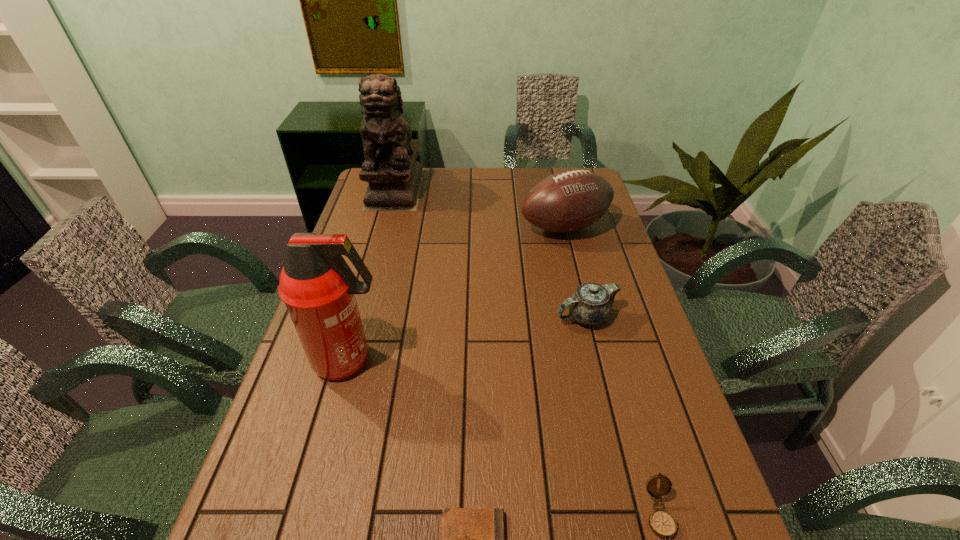
Where is `free region at the far right corner`? free region at the far right corner is located at coordinates (568, 167).

Where is `vacant area that lies between the third nearest object and the fourth shortest object`? The image size is (960, 540). vacant area that lies between the third nearest object and the fourth shortest object is located at coordinates (457, 294).

Where is `unoccupied area between the fire extinguisher and the sculpture`? The width and height of the screenshot is (960, 540). unoccupied area between the fire extinguisher and the sculpture is located at coordinates (372, 274).

This screenshot has width=960, height=540. What are the coordinates of `free space between the fire extinguisher and the fourth shortest object` in the screenshot? It's located at (457, 294).

The height and width of the screenshot is (540, 960). In order to click on vacant space that's between the third nearest object and the sculpture in this screenshot , I will do `click(372, 274)`.

In order to click on vacant space that is in between the fire extinguisher and the chinaware in this screenshot , I will do `click(468, 339)`.

Where is `free space between the football (American) and the fire extinguisher`? The image size is (960, 540). free space between the football (American) and the fire extinguisher is located at coordinates (457, 294).

I want to click on vacant space that is in between the third nearest object and the chinaware, so click(468, 339).

Select which object appears as the fifth closest to the third object from left to right. Please provide its 2D coordinates. Your answer should be formatted as a tuple, i.e. [(x, y)], where the tuple contains the x and y coordinates of a point satisfying the conditions above.

[(394, 176)]

Locate which object is the fifth closest to the shortest object. Please provide its 2D coordinates. Your answer should be formatted as a tuple, i.e. [(x, y)], where the tuple contains the x and y coordinates of a point satisfying the conditions above.

[(394, 176)]